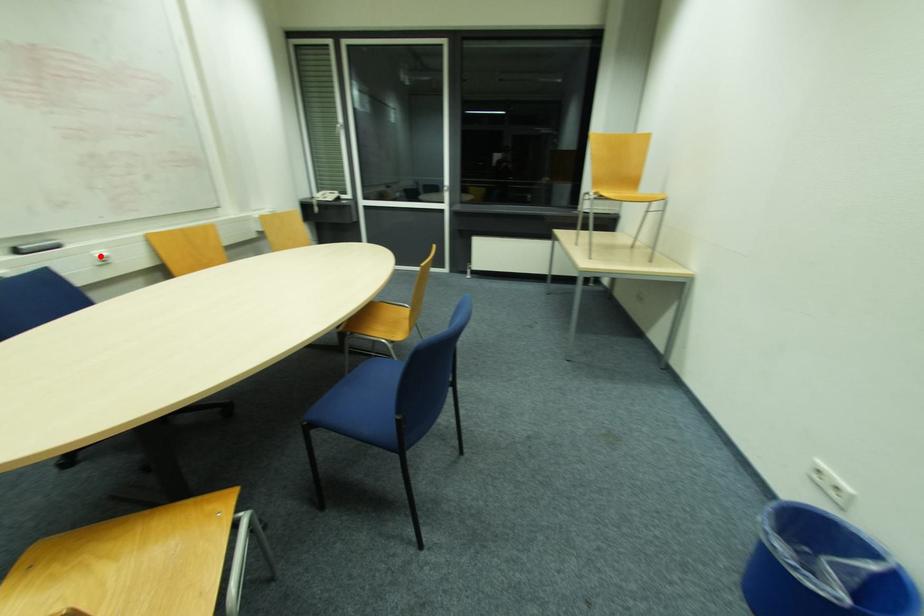
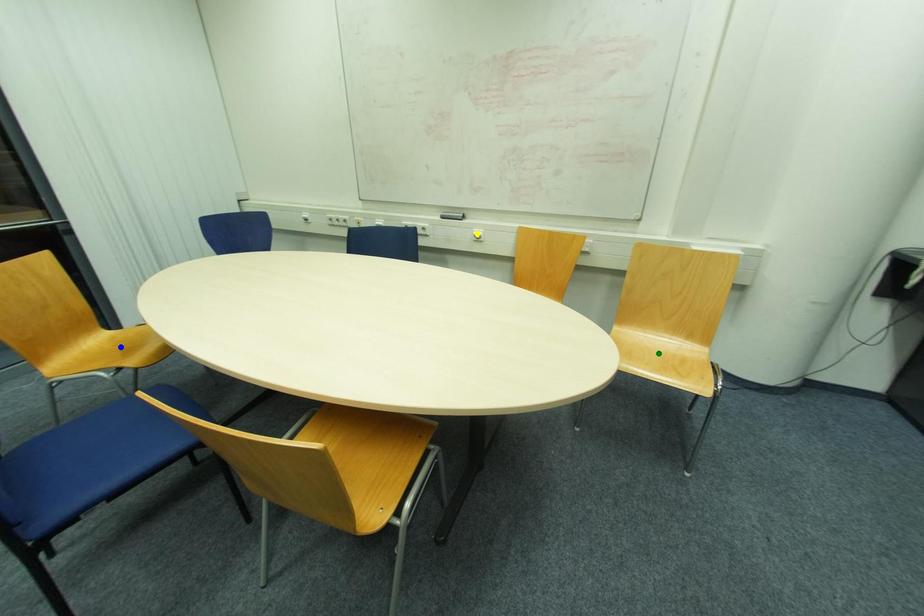
Question: I am providing you with two images of the same scene from different viewpoints. A red point is marked on the first image. You are given multiple points on the second image. Which point in image 2 is actually the same real-world point as the red point in image 1?

Choices:
 (A) blue point
 (B) yellow point
 (C) green point

Answer: (B)